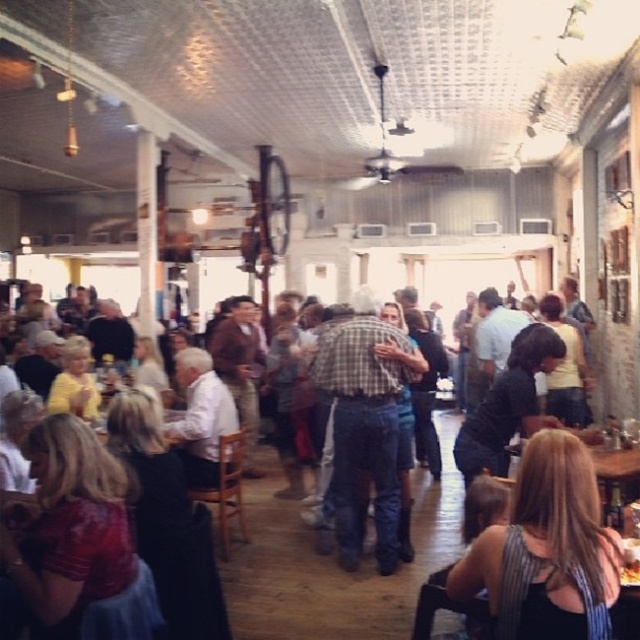
You are standing at the entrance of the venue and notice two people in the foreground. One is wearing a black striped tank top at lower right, and the other has a plaid shirt at center. From your position, which clothing item is closer to you?

The black striped tank top at lower right is closer to you because it is in front of the plaid shirt at center.